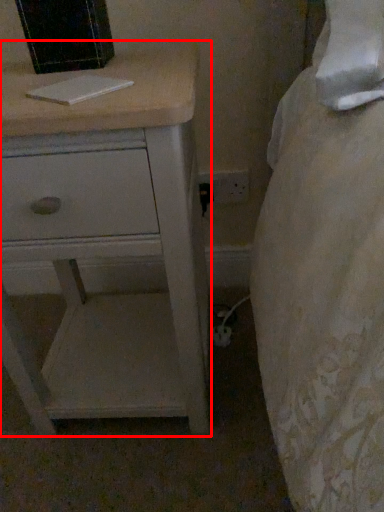
Question: From the image's perspective, where is chest of drawers (annotated by the red box) located relative to book?

Choices:
 (A) above
 (B) below

Answer: (B)